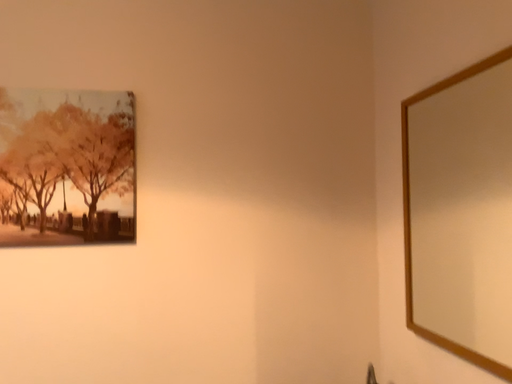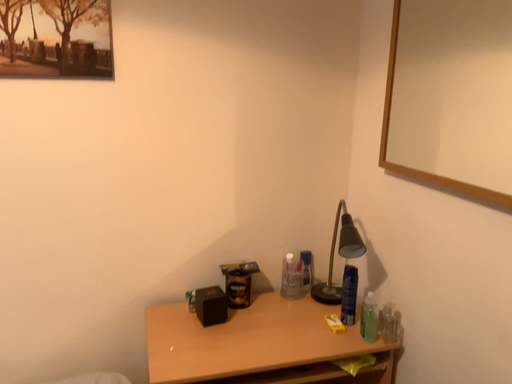
Question: How did the camera likely rotate when shooting the video?

Choices:
 (A) rotated downward
 (B) rotated upward

Answer: (A)